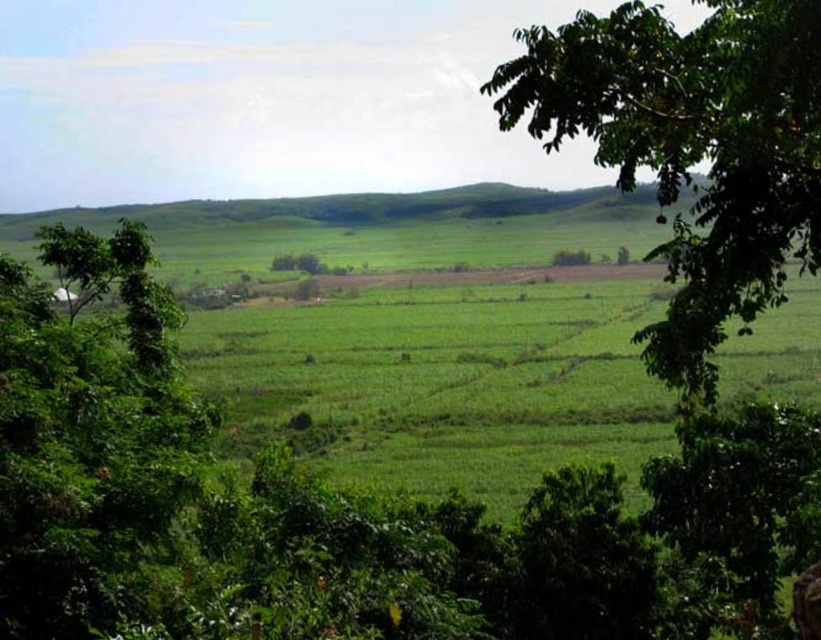
Question: Which point appears farthest from the camera in this image?

Choices:
 (A) (172, 368)
 (B) (771, 333)

Answer: (B)

Question: Does green leafy tree at center have a greater width compared to green leafy tree at left?

Choices:
 (A) no
 (B) yes

Answer: (A)

Question: Where is green grassy field at center located in relation to green leafy tree at left in the image?

Choices:
 (A) above
 (B) below

Answer: (B)

Question: Based on their relative distances, which object is farther from the green leafy tree at center?

Choices:
 (A) green grassy field at center
 (B) green leafy tree at left

Answer: (A)

Question: Is green grassy field at center positioned at the back of green leafy tree at left?

Choices:
 (A) yes
 (B) no

Answer: (A)

Question: Which point is farther from the camera taking this photo?

Choices:
 (A) (404, 305)
 (B) (3, 376)
 (C) (712, 301)

Answer: (A)